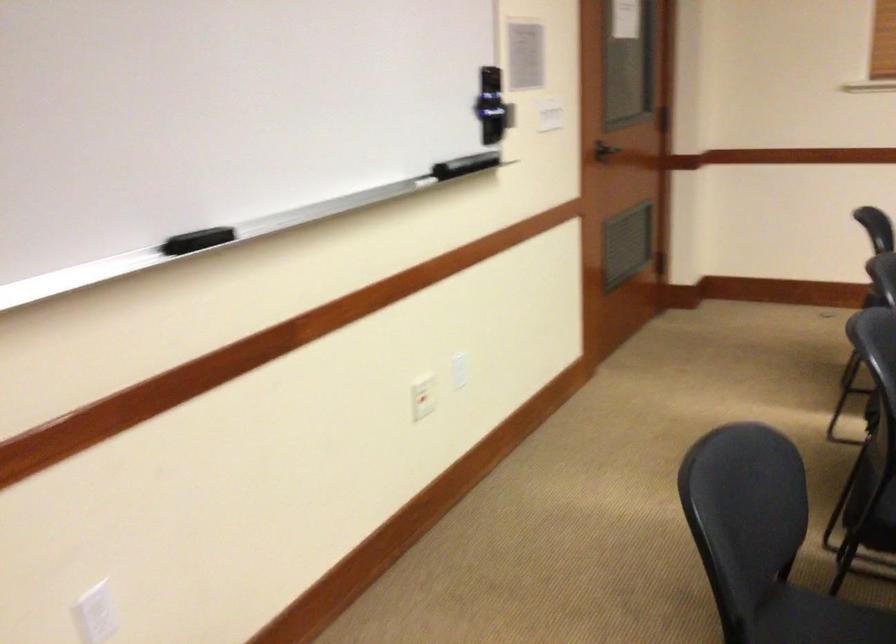
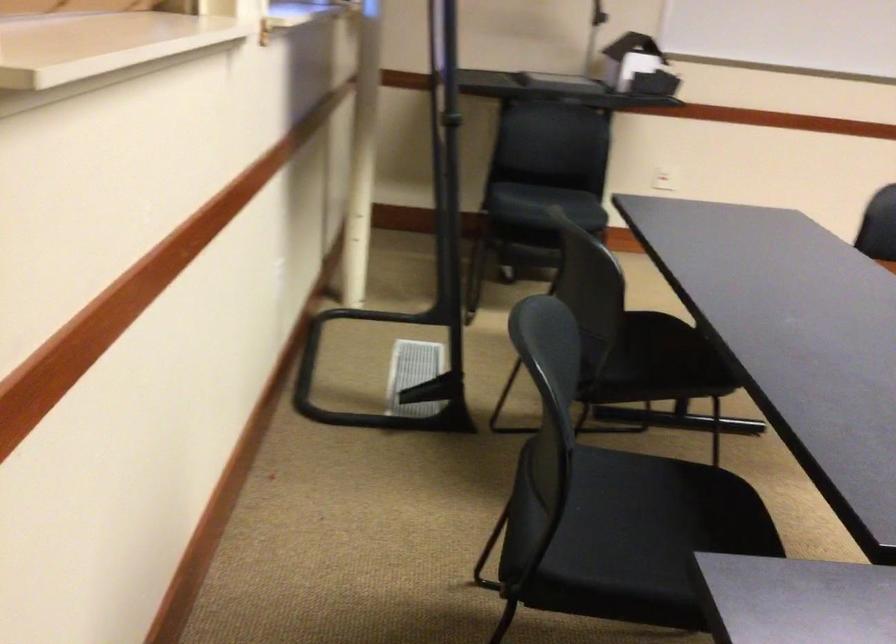
From the picture: The first image is from the beginning of the video and the second image is from the end. How did the camera likely rotate when shooting the video?

The rotation direction of the camera is right-down.